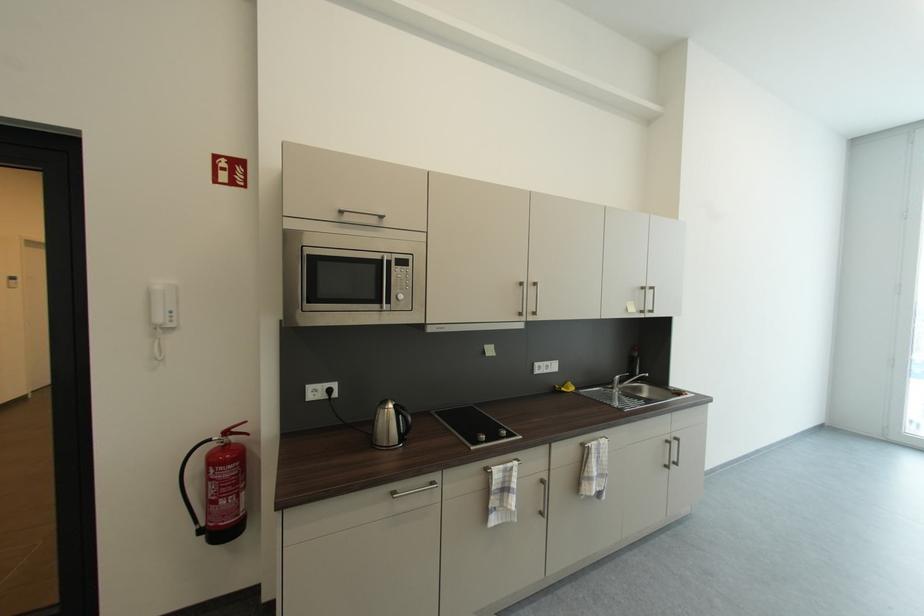
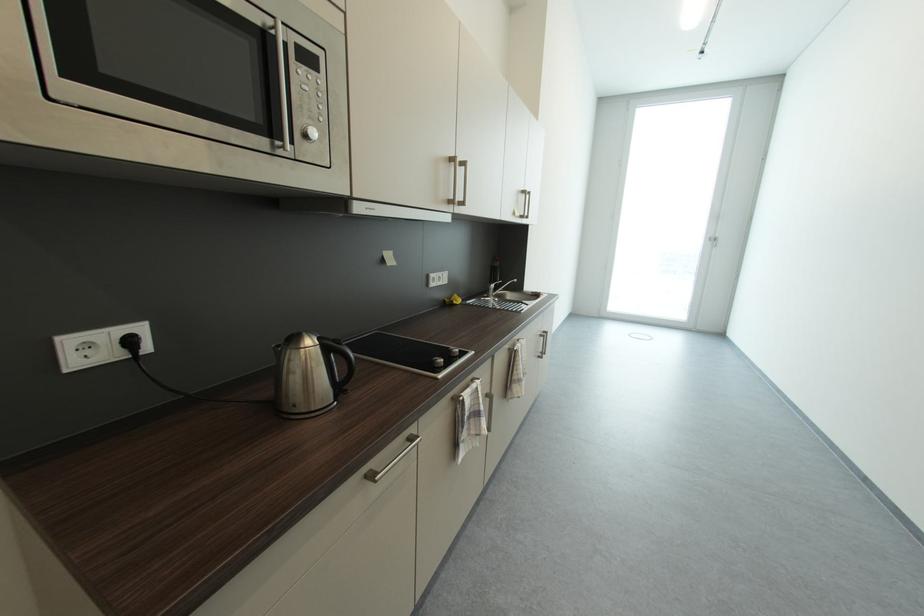
The point at [398,496] is marked in the first image. Where is the corresponding point in the second image?

(377, 479)